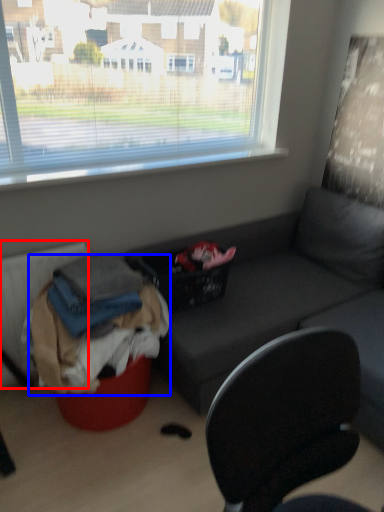
Question: Which object is further to the camera taking this photo, radiator (highlighted by a red box) or clothing (highlighted by a blue box)?

Choices:
 (A) radiator
 (B) clothing

Answer: (A)